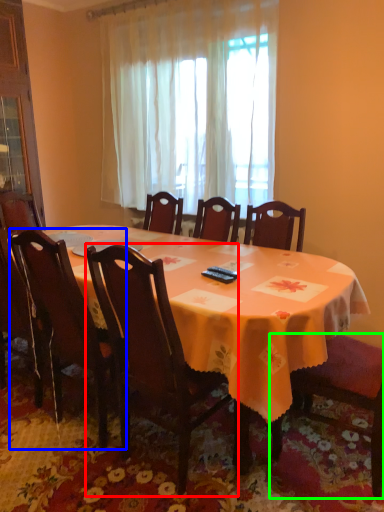
Question: Estimate the real-world distances between objects in this image. Which object is farther from chair (highlighted by a red box), chair (highlighted by a blue box) or chair (highlighted by a green box)?

Choices:
 (A) chair
 (B) chair

Answer: (B)